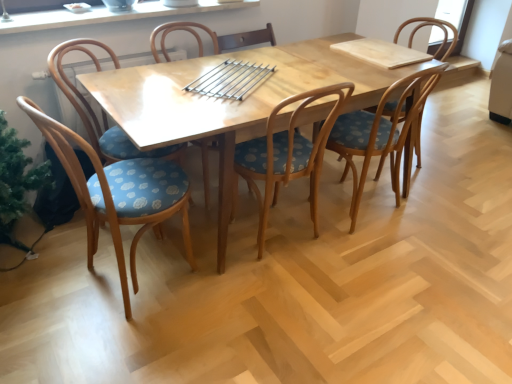
This screenshot has width=512, height=384. Find the location of `vacant area located to the right-hand side of wooden chair with blue polka dot seat cushion at center, the 2th chair when ordered from right to left`. vacant area located to the right-hand side of wooden chair with blue polka dot seat cushion at center, the 2th chair when ordered from right to left is located at coordinates (444, 212).